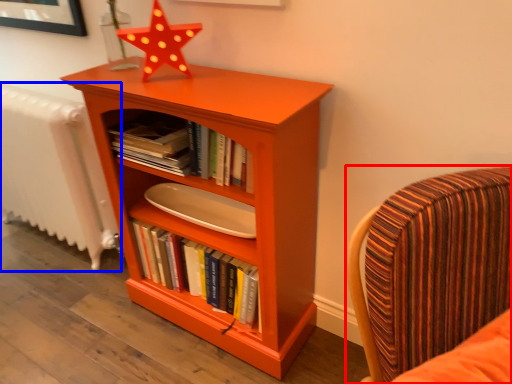
Question: Which object appears farthest to the camera in this image, chair (highlighted by a red box) or radiator (highlighted by a blue box)?

Choices:
 (A) chair
 (B) radiator

Answer: (B)